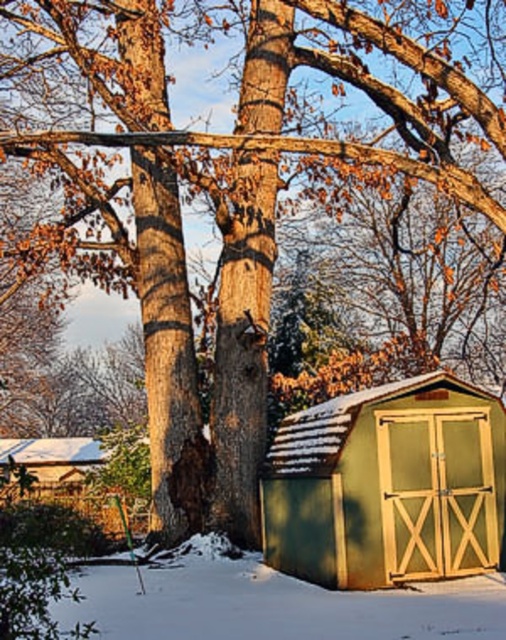
Can you confirm if green wood shed at lower right is positioned above green wooden shed at lower left?

Yes.

Who is taller, green wood shed at lower right or green wooden shed at lower left?

Standing taller between the two is green wood shed at lower right.

Is point (461, 548) farther from camera compared to point (104, 484)?

No, (461, 548) is in front of (104, 484).

At what (x,y) coordinates should I click in order to perform the action: click on green wood shed at lower right. Please return your answer as a coordinate pair (x, y). Looking at the image, I should click on (388, 484).